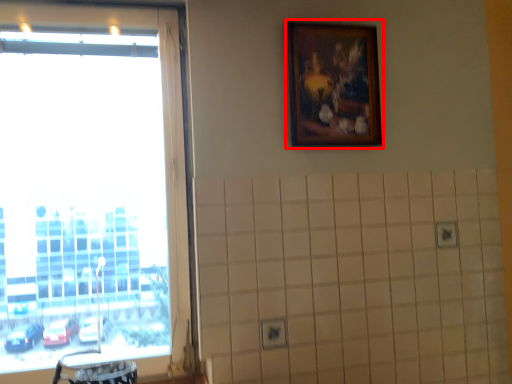
Question: Considering the relative positions of picture frame (annotated by the red box) and window in the image provided, where is picture frame (annotated by the red box) located with respect to the staircase?

Choices:
 (A) right
 (B) left

Answer: (A)